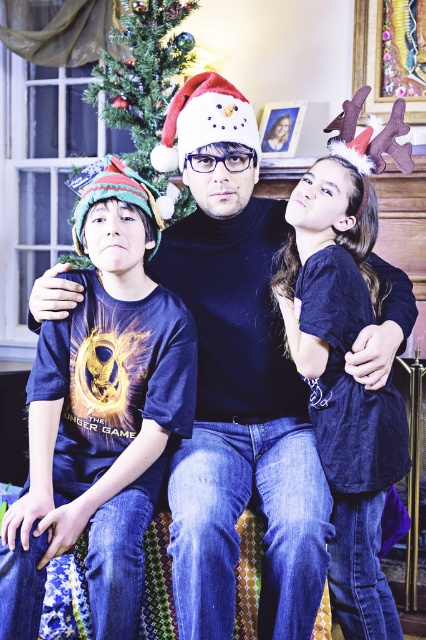
You are a photographer taking a picture of the family. You notice the blue cotton shirt at left and the dark blue velvet shirt at upper right. Which shirt should you focus on first if you want to capture both shirts in the frame without moving the camera?

The blue cotton shirt at left should be focused on first because it is located above the dark blue velvet shirt at upper right, making it easier to frame both shirts in the shot without adjusting the camera position.

You are a drone operator trying to capture a photo of the family scene. The camera is currently positioned at point 0.120, 0.338. Is the green matte christmas tree at upper left in the center of the photo?

The green matte christmas tree at upper left is positioned at point (143, 76), which is where the camera is currently aimed. Therefore, the green matte christmas tree at upper left would be centered in the photo.

Consider the image. You are a photographer taking a picture of the family. You notice the blue cotton shirt at left and the snowman fabric hat at center. Which object should you focus on first to ensure both are in frame?

You should focus on the snowman fabric hat at center first because it is centrally located, ensuring both the blue cotton shirt at left and the snowman fabric hat at center remain in the frame.